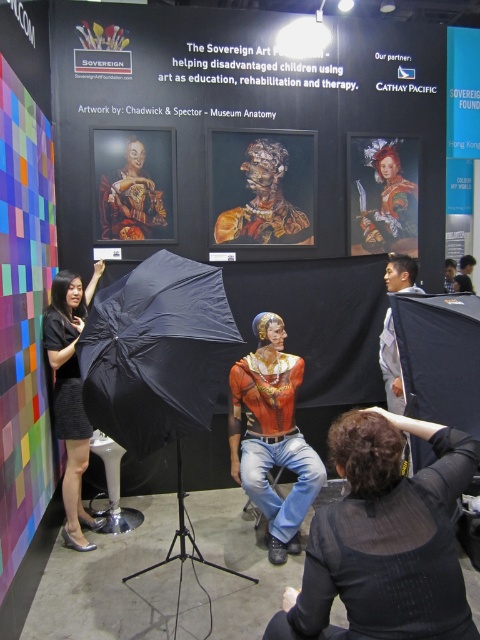
Can you confirm if black fabric umbrella at lower center is positioned below matte black umbrella at center?

Indeed, black fabric umbrella at lower center is positioned under matte black umbrella at center.

Can you confirm if black fabric umbrella at lower center is positioned above matte black umbrella at center?

No, black fabric umbrella at lower center is not above matte black umbrella at center.

Who is more forward, (407,428) or (445,282)?

Positioned in front is point (407,428).

Where is `black fabric umbrella at lower center`? This screenshot has width=480, height=640. black fabric umbrella at lower center is located at coordinates (384, 538).

Is black matte umbrella at left to the left of matte gray suit at center from the viewer's perspective?

Correct, you'll find black matte umbrella at left to the left of matte gray suit at center.

Who is more distant from viewer, (x=142, y=339) or (x=389, y=253)?

The point (x=389, y=253) is behind.

Which is in front, point (94, 356) or point (393, 262)?

Point (94, 356)

The height and width of the screenshot is (640, 480). Find the location of `black matte umbrella at left`. black matte umbrella at left is located at coordinates (156, 353).

Where is `black fabric umbrella at left`? The width and height of the screenshot is (480, 640). black fabric umbrella at left is located at coordinates 71,392.

Is the position of black fabric umbrella at left less distant than that of matte gray suit at center?

Yes.

What do you see at coordinates (71, 392) in the screenshot? The image size is (480, 640). I see `black fabric umbrella at left` at bounding box center [71, 392].

Image resolution: width=480 pixels, height=640 pixels. What are the coordinates of `black fabric umbrella at left` in the screenshot? It's located at (71, 392).